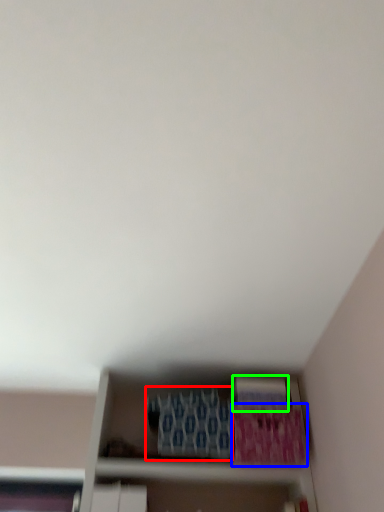
Question: Which is farther away from paperback book (highlighted by a red box)? paperback book (highlighted by a blue box) or paperback book (highlighted by a green box)?

Choices:
 (A) paperback book
 (B) paperback book

Answer: (B)